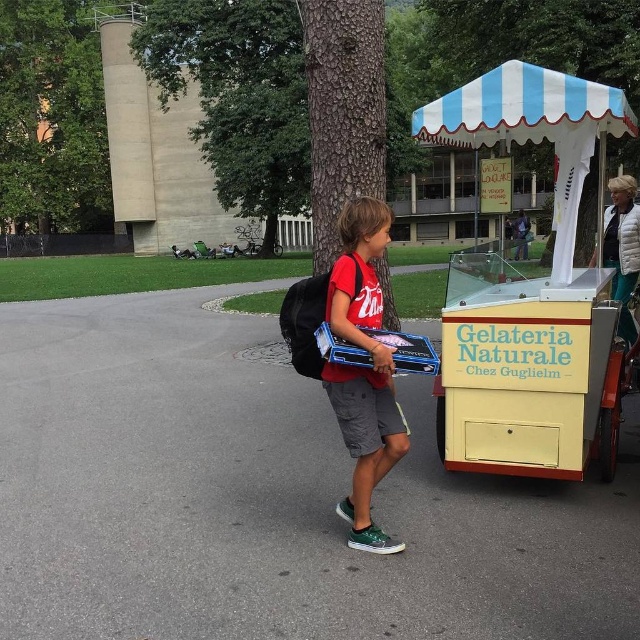
You are the boy holding the blue tray. You want to walk straight ahead to the gelato cart. Is the point at coordinate (452, 292) behind or in front of the point at (356, 372) in your path?

The point at coordinate (452, 292) is behind the point at (356, 372) in your path.

You are the boy in the scene and you want to walk straight ahead to the gelato cart. Is the blue and white striped canopy at upper right located to your left or right side as you walk towards the yellow matte ice cream cart at right?

The blue and white striped canopy at upper right is located to your right side as you walk towards the yellow matte ice cream cart at right because the cart is positioned on the left side of the canopy.